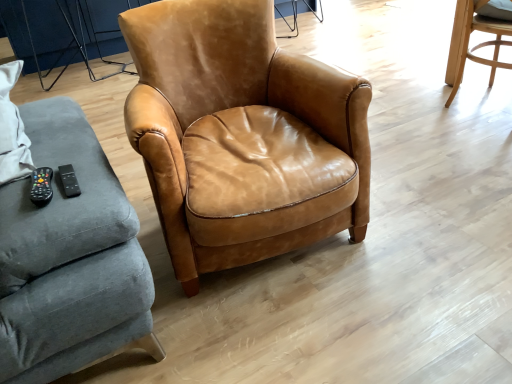
Question: In terms of height, does cognac leather armchair at center, the 2th chair when ordered from right to left, look taller or shorter compared to light brown leather chair at upper right, which appears as the 1th chair when viewed from the right?

Choices:
 (A) tall
 (B) short

Answer: (A)

Question: Is cognac leather armchair at center, the 2th chair when ordered from right to left, to the left or to the right of light brown leather chair at upper right, which appears as the 1th chair when viewed from the right, in the image?

Choices:
 (A) left
 (B) right

Answer: (A)

Question: Based on their sizes in the image, would you say cognac leather armchair at center, acting as the first chair starting from the left, is bigger or smaller than light brown leather chair at upper right, which appears as the 1th chair when viewed from the right?

Choices:
 (A) big
 (B) small

Answer: (A)

Question: Considering the relative positions of light brown leather chair at upper right, which appears as the 1th chair when viewed from the right, and cognac leather armchair at center, the 2th chair when ordered from right to left, in the image provided, is light brown leather chair at upper right, which appears as the 1th chair when viewed from the right, to the left or to the right of cognac leather armchair at center, the 2th chair when ordered from right to left,?

Choices:
 (A) right
 (B) left

Answer: (A)

Question: Is light brown leather chair at upper right, the 2th chair when ordered from left to right, spatially inside cognac leather armchair at center, the 2th chair when ordered from right to left, or outside of it?

Choices:
 (A) inside
 (B) outside

Answer: (B)

Question: Is light brown leather chair at upper right, the 2th chair when ordered from left to right, in front of or behind cognac leather armchair at center, acting as the first chair starting from the left, in the image?

Choices:
 (A) front
 (B) behind

Answer: (B)

Question: From a real-world perspective, relative to cognac leather armchair at center, acting as the first chair starting from the left, is light brown leather chair at upper right, which appears as the 1th chair when viewed from the right, vertically above or below?

Choices:
 (A) above
 (B) below

Answer: (B)